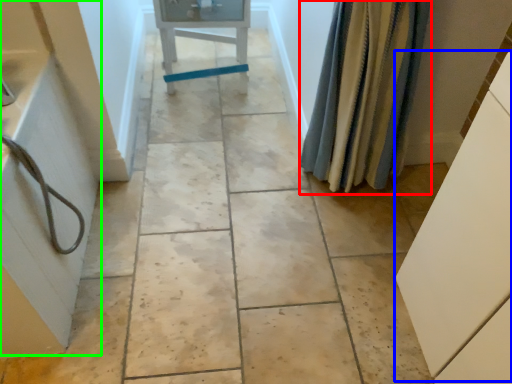
Question: Which is nearer to the shower curtain (highlighted by a red box)? cabinetry (highlighted by a blue box) or bath (highlighted by a green box).

Choices:
 (A) cabinetry
 (B) bath

Answer: (A)